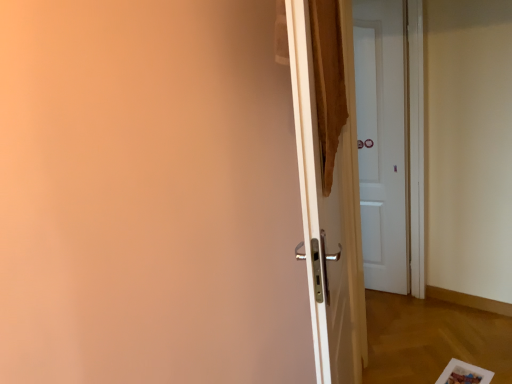
Question: From a real-world perspective, is white glossy door at center, the second door from the back, physically located above or below white matte door at center, which ranks as the first door in right-to-left order?

Choices:
 (A) below
 (B) above

Answer: (A)

Question: In the image, is white glossy door at center, which is the 2th door from right to left, on the left side or the right side of white matte door at center, which is counted as the 2th door, starting from the left?

Choices:
 (A) left
 (B) right

Answer: (A)

Question: Does point (346, 196) appear closer or farther from the camera than point (384, 173)?

Choices:
 (A) closer
 (B) farther

Answer: (A)

Question: Considering the positions of point (398, 150) and point (307, 158), is point (398, 150) closer or farther from the camera than point (307, 158)?

Choices:
 (A) farther
 (B) closer

Answer: (A)

Question: In the image, is white matte door at center, which is counted as the 2th door, starting from the left, positioned in front of or behind white glossy door at center, which is the 2th door from right to left?

Choices:
 (A) front
 (B) behind

Answer: (B)

Question: Considering the positions of white matte door at center, which is the first door in back-to-front order, and white glossy door at center, which is the 2th door from right to left, in the image, is white matte door at center, which is the first door in back-to-front order, wider or thinner than white glossy door at center, which is the 2th door from right to left,?

Choices:
 (A) wide
 (B) thin

Answer: (A)

Question: Is white matte door at center, which is the 2th door from front to back, spatially inside white glossy door at center, the second door from the back, or outside of it?

Choices:
 (A) inside
 (B) outside

Answer: (B)